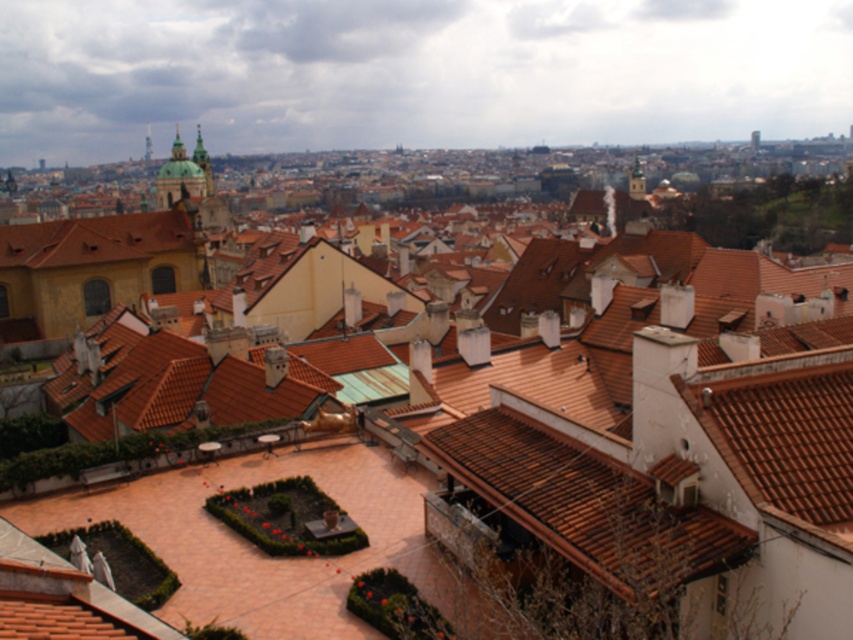
You are standing in the courtyard with the golden statue of a horse. You want to walk to the brown tile roof at center and then to the matte orange tile roof at left. What is the total distance you need to walk?

The total distance you need to walk is 79.67 meters.

You are an architect analyzing the cityscape. You observe the brown tile roof at center and the matte orange tile roof at left. Which of these two roofs has a larger surface area?

The matte orange tile roof at left has a larger surface area than the brown tile roof at center because the brown tile roof at center is smaller than matte orange tile roof at left.

You are a city planner reviewing this urban design. The golden statue of a horse in the courtyard needs to be moved to the location of the brown tile roof at center. What are the coordinates you should input into the GPS system to relocate the statue?

The coordinates for the brown tile roof at center are (585, 502), so you should input those coordinates into the GPS system to relocate the statue there.